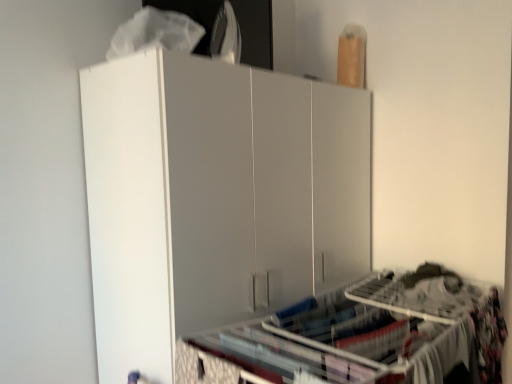
What do you see at coordinates (215, 198) in the screenshot? I see `white matte cabinet at center` at bounding box center [215, 198].

Locate an element on the screen. white matte cabinet at center is located at coordinates (215, 198).

What are the coordinates of `white matte cabinet at center` in the screenshot? It's located at (215, 198).